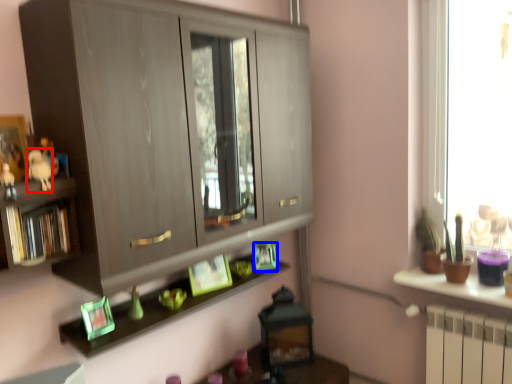
Question: Which object is further to the camera taking this photo, animal (highlighted by a red box) or picture frame (highlighted by a blue box)?

Choices:
 (A) animal
 (B) picture frame

Answer: (B)